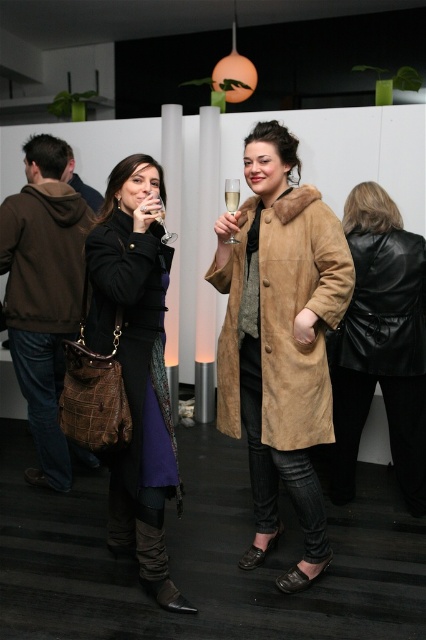
You are at the center of the image and want to place a new accessory on the brown suede hoodie at left. Based on its current position, which direction should you move relative to the hoodie to position the accessory correctly?

The brown suede hoodie at left is located at point (43, 292), so you should move towards the lower right direction to position the accessory correctly.

You are a photographer at the event and want to capture a closeup of the clear glass at upper center without the clear glass wine glass at upper center blocking it. Is this possible based on their positions?

Yes, because the clear glass at upper center is closer to the photographer than the clear glass wine glass at upper center, so it won